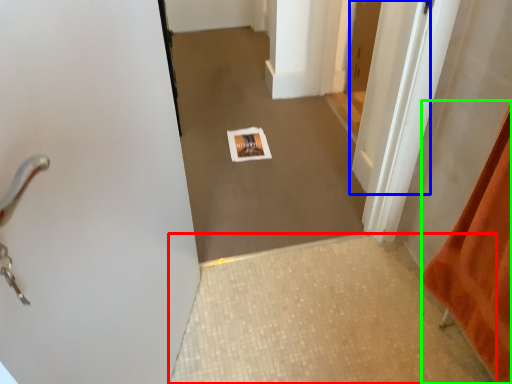
Question: Considering the real-world distances, which object is farthest from tile (highlighted by a red box)? door (highlighted by a blue box) or blanket (highlighted by a green box)?

Choices:
 (A) door
 (B) blanket

Answer: (A)